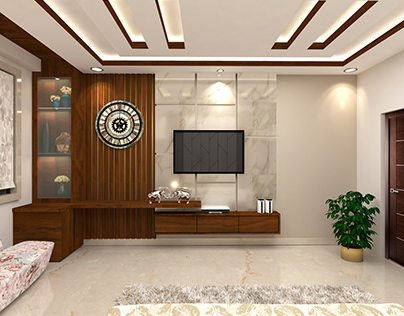
The image size is (404, 316). What are the coordinates of `recessed light` in the screenshot? It's located at click(350, 69), click(218, 69), click(97, 69).